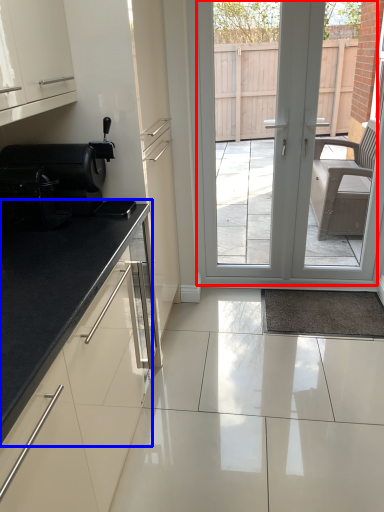
Question: Which object is further to the camera taking this photo, door (highlighted by a red box) or countertop (highlighted by a blue box)?

Choices:
 (A) door
 (B) countertop

Answer: (A)